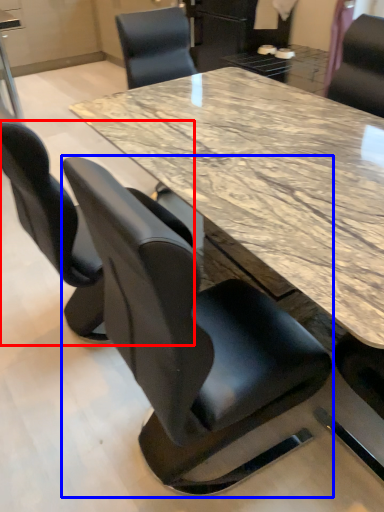
Question: Among these objects, which one is farthest to the camera, chair (highlighted by a red box) or chair (highlighted by a blue box)?

Choices:
 (A) chair
 (B) chair

Answer: (A)